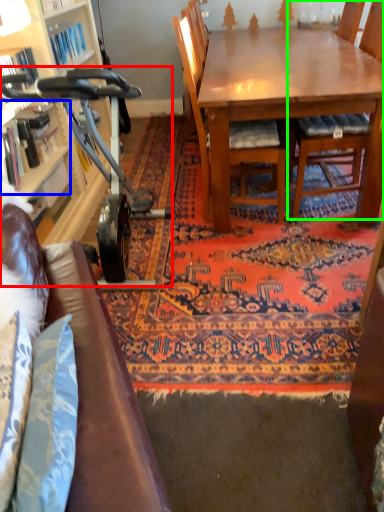
Question: Based on their relative distances, which object is nearer to baby carriage (highlighted by a red box)? Choose from shelf (highlighted by a blue box) and chair (highlighted by a green box).

Choices:
 (A) shelf
 (B) chair

Answer: (A)